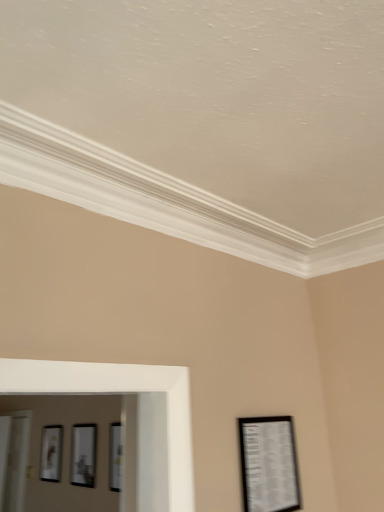
Question: Can you confirm if matte black picture frame at left, the 3th picture frame positioned from the right, is bigger than matte black picture frame at lower right, the first picture frame viewed from the right?

Choices:
 (A) no
 (B) yes

Answer: (B)

Question: From the image's perspective, is matte black picture frame at left, arranged as the 3th picture frame when viewed from the front, beneath matte black picture frame at lower right, the third picture frame in the back-to-front sequence?

Choices:
 (A) yes
 (B) no

Answer: (A)

Question: Is matte black picture frame at left, which is the 1th picture frame in back-to-front order, at the left side of matte black picture frame at lower right, which is the third picture frame in left-to-right order?

Choices:
 (A) yes
 (B) no

Answer: (A)

Question: From the image's perspective, does matte black picture frame at left, the 3th picture frame from the top, appear higher than matte black picture frame at lower right, which is the first picture frame from front to back?

Choices:
 (A) yes
 (B) no

Answer: (B)

Question: Does matte black picture frame at left, which is the 1th picture frame in back-to-front order, have a smaller size compared to matte black picture frame at lower right, which is the third picture frame in left-to-right order?

Choices:
 (A) no
 (B) yes

Answer: (A)

Question: Would you say matte black picture frame at left, the 3th picture frame from the top, is a long distance from matte black picture frame at lower right, which is the first picture frame from front to back?

Choices:
 (A) yes
 (B) no

Answer: (A)

Question: Is matte black picture frame at lower right, the first picture frame viewed from the right, outside of matte black picture frame at left, the 3th picture frame positioned from the right?

Choices:
 (A) no
 (B) yes

Answer: (B)

Question: Does matte black picture frame at lower right, which is the third picture frame in left-to-right order, come behind matte black picture frame at left, the first picture frame from the left?

Choices:
 (A) yes
 (B) no

Answer: (B)

Question: Is matte black picture frame at lower right, the third picture frame in the back-to-front sequence, facing away from matte black picture frame at left, the 1th picture frame in the bottom-to-top sequence?

Choices:
 (A) no
 (B) yes

Answer: (B)

Question: Can you confirm if matte black picture frame at lower right, the third picture frame in the back-to-front sequence, is smaller than matte black picture frame at left, the 3th picture frame positioned from the right?

Choices:
 (A) no
 (B) yes

Answer: (B)

Question: Can you confirm if matte black picture frame at lower right, marked as the 1th picture frame in a top-to-bottom arrangement, is positioned to the left of matte black picture frame at left, the 3th picture frame from the top?

Choices:
 (A) yes
 (B) no

Answer: (B)

Question: Are matte black picture frame at lower right, marked as the 1th picture frame in a top-to-bottom arrangement, and matte black picture frame at left, the 3th picture frame positioned from the right, located far from each other?

Choices:
 (A) no
 (B) yes

Answer: (B)

Question: Is matte black picture frame at center, positioned as the second picture frame in right-to-left order, not within matte black picture frame at left, the 3th picture frame from the top?

Choices:
 (A) no
 (B) yes

Answer: (B)